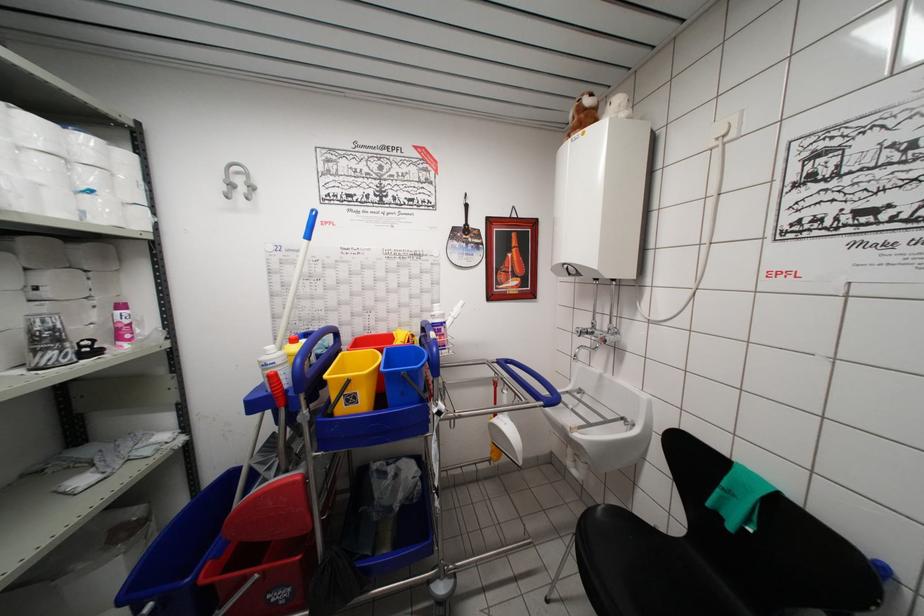
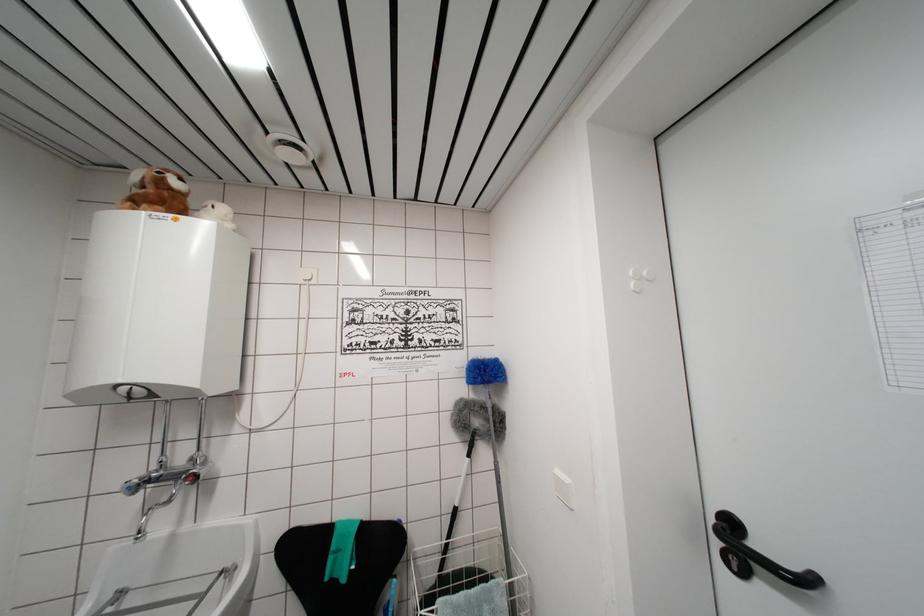
Where in the second image is the point corresponding to (585,131) from the first image?

(168, 209)